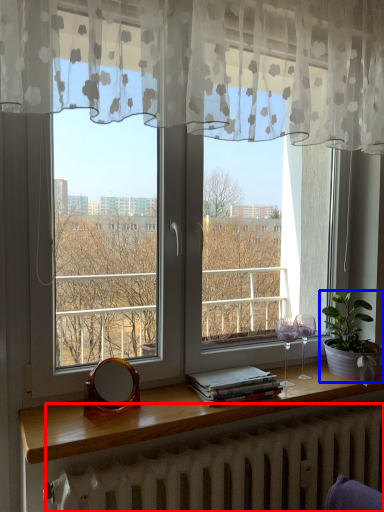
Question: Which point is further to the camera, radiator (highlighted by a red box) or houseplant (highlighted by a blue box)?

Choices:
 (A) radiator
 (B) houseplant

Answer: (B)